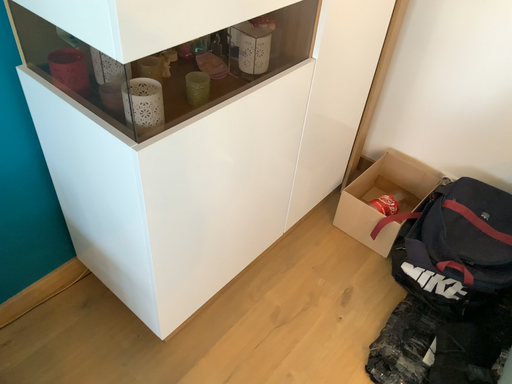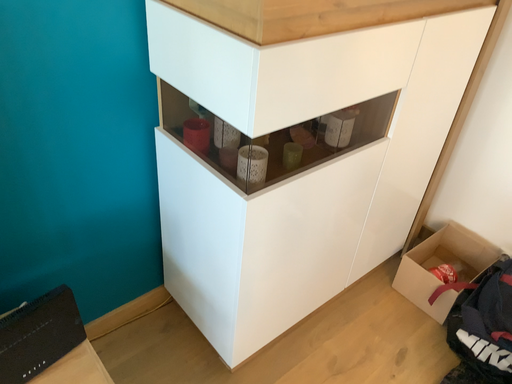
Question: Which way did the camera rotate in the video?

Choices:
 (A) rotated upward
 (B) rotated downward

Answer: (A)